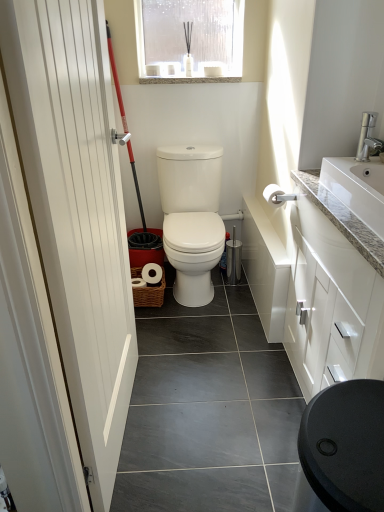
Question: Considering the relative sizes of white matte toilet paper at upper right and white smooth door at left in the image provided, is white matte toilet paper at upper right smaller than white smooth door at left?

Choices:
 (A) yes
 (B) no

Answer: (A)

Question: Considering the relative sizes of white matte toilet paper at upper right and white smooth door at left in the image provided, is white matte toilet paper at upper right bigger than white smooth door at left?

Choices:
 (A) no
 (B) yes

Answer: (A)

Question: Is white matte toilet paper at upper right outside of white smooth door at left?

Choices:
 (A) no
 (B) yes

Answer: (B)

Question: Does white matte toilet paper at upper right come in front of white smooth door at left?

Choices:
 (A) yes
 (B) no

Answer: (B)

Question: Can you confirm if white matte toilet paper at upper right is thinner than white smooth door at left?

Choices:
 (A) no
 (B) yes

Answer: (A)

Question: From the image's perspective, is white matte toilet paper at upper right beneath white smooth door at left?

Choices:
 (A) no
 (B) yes

Answer: (A)

Question: Can you confirm if translucent plastic window at upper center is bigger than white smooth door at left?

Choices:
 (A) no
 (B) yes

Answer: (A)

Question: Could white smooth door at left be considered to be inside translucent plastic window at upper center?

Choices:
 (A) no
 (B) yes

Answer: (A)

Question: Is translucent plastic window at upper center further to camera compared to white smooth door at left?

Choices:
 (A) yes
 (B) no

Answer: (A)

Question: Can you confirm if translucent plastic window at upper center is taller than white smooth door at left?

Choices:
 (A) yes
 (B) no

Answer: (B)

Question: Can you confirm if translucent plastic window at upper center is wider than white smooth door at left?

Choices:
 (A) yes
 (B) no

Answer: (A)

Question: Is translucent plastic window at upper center shorter than white smooth door at left?

Choices:
 (A) no
 (B) yes

Answer: (B)

Question: Would you say translucent plastic window at upper center is part of white granite sink at upper right's contents?

Choices:
 (A) yes
 (B) no

Answer: (B)